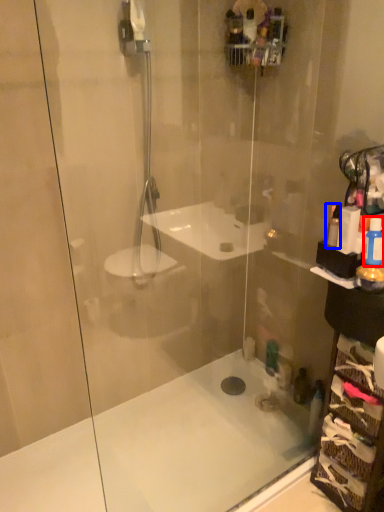
Question: Which point is closer to the camera, toiletry (highlighted by a red box) or toiletry (highlighted by a blue box)?

Choices:
 (A) toiletry
 (B) toiletry

Answer: (A)